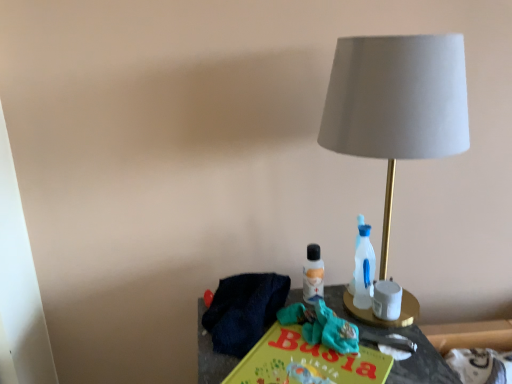
Measure the distance between point (353, 97) and camera.

The depth of point (353, 97) is 24.33 inches.

What do you see at coordinates (397, 103) in the screenshot? The image size is (512, 384). I see `matte gray fabric lampshade at right` at bounding box center [397, 103].

Where is `matte black book at center`? This screenshot has height=384, width=512. matte black book at center is located at coordinates (412, 353).

Where is `yellow matte paper at center`? This screenshot has height=384, width=512. yellow matte paper at center is located at coordinates (306, 362).

Where is `matte gray fabric lampshade at right`? This screenshot has width=512, height=384. matte gray fabric lampshade at right is located at coordinates (397, 103).

From a real-world perspective, is yellow matte paper at center physically above matte gray fabric lampshade at right?

No.

Is yellow matte paper at center wider than matte gray fabric lampshade at right?

Indeed, yellow matte paper at center has a greater width compared to matte gray fabric lampshade at right.

Looking at this image, is yellow matte paper at center at the left side of matte gray fabric lampshade at right?

Yes, yellow matte paper at center is to the left of matte gray fabric lampshade at right.

Between yellow matte paper at center and matte gray fabric lampshade at right, which one is positioned behind?

matte gray fabric lampshade at right is more distant.

In the scene shown: Is yellow matte paper at center surrounding white matte candle holder at right?

No, white matte candle holder at right is not inside yellow matte paper at center.

Considering the sizes of objects yellow matte paper at center and white matte candle holder at right in the image provided, who is shorter, yellow matte paper at center or white matte candle holder at right?

Standing shorter between the two is yellow matte paper at center.

Considering the relative sizes of yellow matte paper at center and white matte candle holder at right in the image provided, is yellow matte paper at center wider than white matte candle holder at right?

Indeed, yellow matte paper at center has a greater width compared to white matte candle holder at right.

From the image's perspective, which is above, yellow matte paper at center or white matte candle holder at right?

white matte candle holder at right is shown above in the image.

From the image's perspective, which one is positioned lower, white matte candle holder at right or yellow matte paper at center?

yellow matte paper at center is shown below in the image.

Would you say white matte candle holder at right is outside yellow matte paper at center?

Absolutely, white matte candle holder at right is external to yellow matte paper at center.

Considering the positions of objects white matte candle holder at right and yellow matte paper at center in the image provided, who is more to the right, white matte candle holder at right or yellow matte paper at center?

From the viewer's perspective, white matte candle holder at right appears more on the right side.

What are the coordinates of `candle holder above the yellow matte paper at center (from the image's perspective)` in the screenshot? It's located at (382, 319).

Considering their positions, is white matte candle holder at right located in front of or behind matte gray fabric lampshade at right?

white matte candle holder at right is behind matte gray fabric lampshade at right.

Considering the points (394, 321) and (350, 109), which point is in front, point (394, 321) or point (350, 109)?

The point (350, 109) is more forward.

From the image's perspective, relative to matte gray fabric lampshade at right, is white matte candle holder at right above or below?

Result: Based on their image positions, white matte candle holder at right is located beneath matte gray fabric lampshade at right.

Would you say matte gray fabric lampshade at right is part of white matte candle holder at right's contents?

Definitely not — matte gray fabric lampshade at right is not inside white matte candle holder at right.

Does matte gray fabric lampshade at right come behind teal fabric scrub at center?

No.

From the picture: Are matte gray fabric lampshade at right and teal fabric scrub at center located far from each other?

No.

Can you confirm if matte gray fabric lampshade at right is positioned to the left of teal fabric scrub at center?

In fact, matte gray fabric lampshade at right is to the right of teal fabric scrub at center.

Does teal fabric scrub at center turn towards white matte candle holder at right?

No, teal fabric scrub at center is not aimed at white matte candle holder at right.

Is teal fabric scrub at center far from white matte candle holder at right?

That's not correct — teal fabric scrub at center is a little close to white matte candle holder at right.

Considering the points (318, 314) and (389, 325), which point is in front, point (318, 314) or point (389, 325)?

Point (318, 314)

What's the angular difference between matte gray fabric lampshade at right and yellow matte paper at center's facing directions?

There is a 37-degree angle between the facing directions of matte gray fabric lampshade at right and yellow matte paper at center.

Is point (344, 95) closer or farther from the camera than point (380, 354)?

Point (344, 95) appears to be closer to the viewer than point (380, 354).

Identify the location of paperback book below the matte gray fabric lampshade at right (from a real-world perspective). (306, 362).

Is yellow matte paper at center at the back of matte gray fabric lampshade at right?

No, yellow matte paper at center is not at the back of matte gray fabric lampshade at right.

Locate an element on the screen. lamp on the right of yellow matte paper at center is located at coordinates (397, 103).

Where is `candle holder located behind the yellow matte paper at center`? The height and width of the screenshot is (384, 512). candle holder located behind the yellow matte paper at center is located at coordinates [382, 319].

From the image, which object appears to be nearer to white matte candle holder at right, matte black book at center or teal fabric scrub at center?

matte black book at center lies closer to white matte candle holder at right than the other object.

In the scene shown: From the image, which object appears to be farther from matte black book at center, matte gray fabric lampshade at right or yellow matte paper at center?

matte gray fabric lampshade at right is further to matte black book at center.

Looking at the image, which one is located further to teal fabric scrub at center, matte black book at center or yellow matte paper at center?

matte black book at center is positioned further to the anchor teal fabric scrub at center.

Based on their spatial positions, is teal fabric scrub at center or yellow matte paper at center further from white matte candle holder at right?

yellow matte paper at center is further to white matte candle holder at right.

When comparing their distances from matte gray fabric lampshade at right, does yellow matte paper at center or white matte candle holder at right seem closer?

Among the two, yellow matte paper at center is located nearer to matte gray fabric lampshade at right.

Based on their spatial positions, is teal fabric scrub at center or matte black book at center further from white matte candle holder at right?

teal fabric scrub at center.

Based on their spatial positions, is white matte candle holder at right or yellow matte paper at center closer to teal fabric scrub at center?

yellow matte paper at center is positioned closer to the anchor teal fabric scrub at center.

Which object lies nearer to the anchor point white matte candle holder at right, matte black book at center or yellow matte paper at center?

Based on the image, matte black book at center appears to be nearer to white matte candle holder at right.

Locate an element on the screen. This screenshot has width=512, height=384. scrub between yellow matte paper at center and white matte candle holder at right in the front-back direction is located at coordinates (322, 327).

I want to click on scrub between matte gray fabric lampshade at right and yellow matte paper at center from top to bottom, so click(322, 327).

Locate an element on the screen. paperback book between teal fabric scrub at center and matte black book at center in the vertical direction is located at coordinates (306, 362).

This screenshot has width=512, height=384. What are the coordinates of `candle holder between matte gray fabric lampshade at right and matte black book at center in the vertical direction` in the screenshot? It's located at (382, 319).